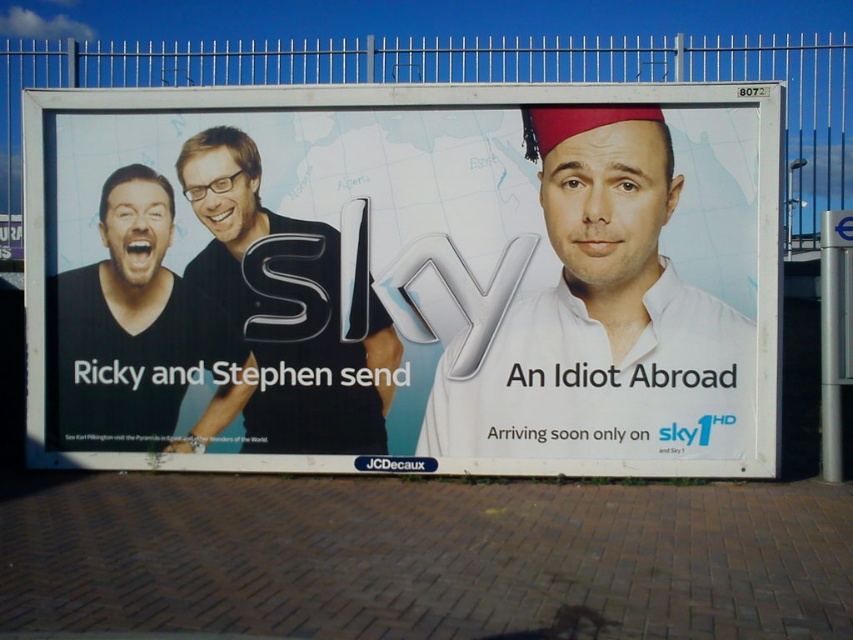
Question: Which point is farther to the camera?

Choices:
 (A) (280, 266)
 (B) (302, 360)
 (C) (114, 273)

Answer: (C)

Question: Is white paper billboard at center wider than white matte headwear at center?

Choices:
 (A) yes
 (B) no

Answer: (B)

Question: Does white paper billboard at center have a lesser width compared to white matte headwear at center?

Choices:
 (A) no
 (B) yes

Answer: (B)

Question: Is white paper billboard at center bigger than white matte headwear at center?

Choices:
 (A) no
 (B) yes

Answer: (A)

Question: Which point appears closest to the camera in this image?

Choices:
 (A) (352, 376)
 (B) (109, 272)
 (C) (564, 212)
 (D) (770, 403)

Answer: (D)

Question: Among these points, which one is farthest from the camera?

Choices:
 (A) (201, 205)
 (B) (621, 372)

Answer: (A)